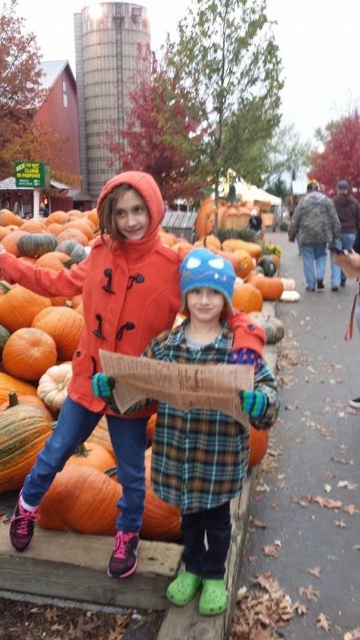
From the picture: You are a photographer planning to take a photo of the two children wearing the matte orange coat at center and the plaid fabric coat at center. To ensure both are in frame, where should you position yourself relative to the children?

You should position yourself to the right of the children because the matte orange coat at center is to the left of the plaid fabric coat at center, so placing yourself to the right will keep both in the frame.

You are a parent trying to choose a coat for your child from the two coats shown in the image. The matte orange coat at center and the plaid fabric coat at center. Which coat has a bigger size?

The matte orange coat at center has a larger size compared to the plaid fabric coat at center.

You are a photographer trying to capture the two children in the scene. The children are wearing a matte orange coat at center and a plaid fabric coat at center. Based on their positions, which child is standing higher relative to the other?

The matte orange coat at center is above the plaid fabric coat at center, so the child wearing the matte orange coat at center is standing higher than the one in the plaid fabric coat at center.